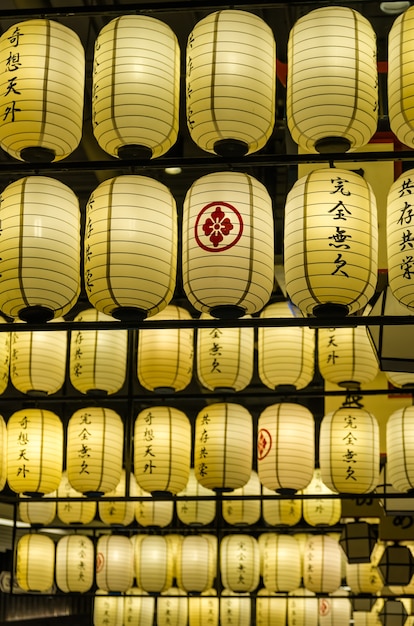
I want to click on yellow lantern, so click(36, 41).